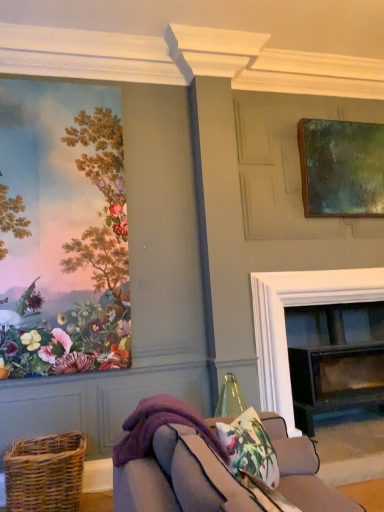
Question: Is black glass fireplace at center not near matte floral wallpaper at left, which is the 1th picture frame in left-to-right order?

Choices:
 (A) no
 (B) yes

Answer: (B)

Question: Can you confirm if black glass fireplace at center is wider than matte floral wallpaper at left, positioned as the 2th picture frame in back-to-front order?

Choices:
 (A) no
 (B) yes

Answer: (B)

Question: Is black glass fireplace at center directly adjacent to matte floral wallpaper at left, the second picture frame positioned from the right?

Choices:
 (A) yes
 (B) no

Answer: (B)

Question: Can you confirm if black glass fireplace at center is positioned to the right of matte floral wallpaper at left, positioned as the 2th picture frame in back-to-front order?

Choices:
 (A) yes
 (B) no

Answer: (A)

Question: Can you confirm if black glass fireplace at center is taller than matte floral wallpaper at left, the second picture frame positioned from the right?

Choices:
 (A) no
 (B) yes

Answer: (A)

Question: From their relative heights in the image, would you say floral fabric cushion at lower center is taller or shorter than matte floral wallpaper at left, the second picture frame positioned from the right?

Choices:
 (A) short
 (B) tall

Answer: (A)

Question: From a real-world perspective, is floral fabric cushion at lower center above or below matte floral wallpaper at left, the 1th picture frame positioned from the front?

Choices:
 (A) below
 (B) above

Answer: (A)

Question: Is floral fabric cushion at lower center inside or outside of matte floral wallpaper at left, the second picture frame positioned from the right?

Choices:
 (A) outside
 (B) inside

Answer: (A)

Question: Considering the relative positions of floral fabric cushion at lower center and matte floral wallpaper at left, the 1th picture frame positioned from the front, in the image provided, is floral fabric cushion at lower center to the left or to the right of matte floral wallpaper at left, the 1th picture frame positioned from the front,?

Choices:
 (A) left
 (B) right

Answer: (B)

Question: Is point (72, 309) closer or farther from the camera than point (185, 408)?

Choices:
 (A) farther
 (B) closer

Answer: (A)

Question: In the image, is matte floral wallpaper at left, which is the 1th picture frame in left-to-right order, on the left side or the right side of purple fleece blanket at lower center?

Choices:
 (A) left
 (B) right

Answer: (A)

Question: In the image, is matte floral wallpaper at left, which is the 1th picture frame in left-to-right order, positioned in front of or behind purple fleece blanket at lower center?

Choices:
 (A) behind
 (B) front

Answer: (A)

Question: In terms of height, does matte floral wallpaper at left, which is the 1th picture frame in left-to-right order, look taller or shorter compared to purple fleece blanket at lower center?

Choices:
 (A) short
 (B) tall

Answer: (B)

Question: From a real-world perspective, is greenish-brown wooden frame at upper right, acting as the first picture frame starting from the back, physically located above or below purple fleece blanket at lower center?

Choices:
 (A) above
 (B) below

Answer: (A)

Question: In terms of size, does greenish-brown wooden frame at upper right, which appears as the first picture frame when viewed from the right, appear bigger or smaller than purple fleece blanket at lower center?

Choices:
 (A) small
 (B) big

Answer: (B)